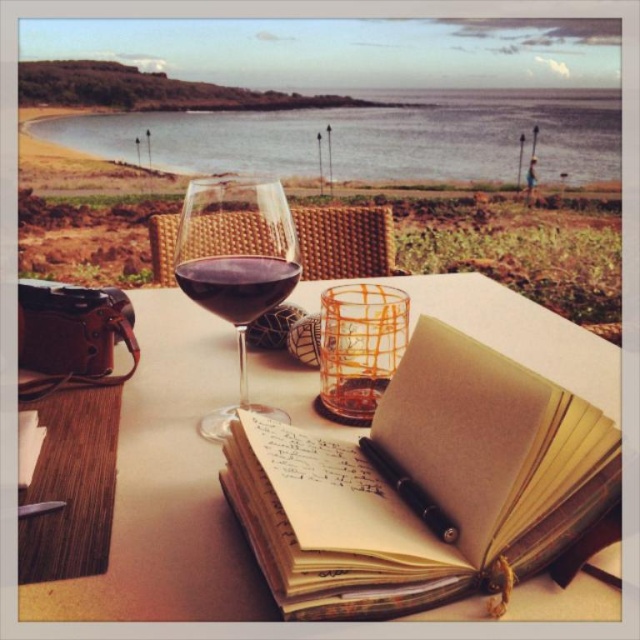
Question: Is beige paper notebook at center to the right of black metallic pen at center from the viewer's perspective?

Choices:
 (A) no
 (B) yes

Answer: (A)

Question: Which point is closer to the camera taking this photo?

Choices:
 (A) [284, 284]
 (B) [390, 481]
 (C) [200, 269]
 (D) [552, 472]

Answer: (D)

Question: Which point appears closest to the camera in this image?

Choices:
 (A) (406, 160)
 (B) (253, 305)
 (C) (237, 278)
 (D) (444, 524)

Answer: (D)

Question: Among these objects, which one is farthest from the camera?

Choices:
 (A) clear water at upper center
 (B) black metallic pen at center
 (C) dark purple glass at center

Answer: (A)

Question: Is translucent glass wine glass at center smaller than black metallic pen at center?

Choices:
 (A) yes
 (B) no

Answer: (B)

Question: Does translucent glass wine glass at center have a lesser width compared to black metallic pen at center?

Choices:
 (A) no
 (B) yes

Answer: (A)